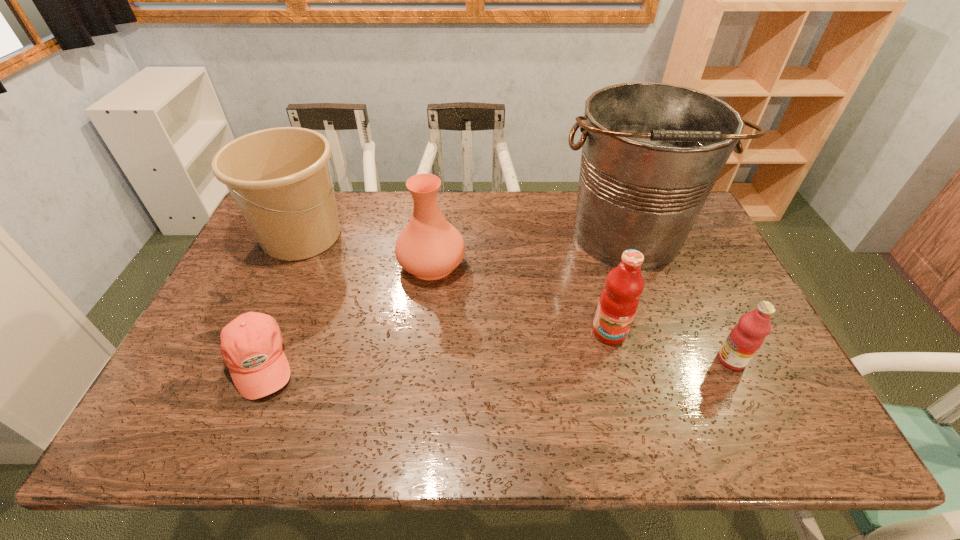
I want to click on vacant space located on the front of the left bucket, so click(259, 331).

The width and height of the screenshot is (960, 540). In order to click on vacant region located on the right of the vase in this screenshot , I will do `click(587, 264)`.

At what (x,y) coordinates should I click in order to perform the action: click on vacant area situated 0.180m on the front label of the farther fruit juice. Please return your answer as a coordinate pair (x, y). Image resolution: width=960 pixels, height=540 pixels. Looking at the image, I should click on (630, 411).

Where is `free spot located on the label of the second shortest object`? Image resolution: width=960 pixels, height=540 pixels. free spot located on the label of the second shortest object is located at coordinates (581, 360).

Identify the location of vacant space located 0.260m on the label of the second shortest object. This screenshot has width=960, height=540. (613, 360).

Identify the location of free spot located 0.050m on the label of the second shortest object. (698, 360).

This screenshot has width=960, height=540. Find the location of `free space located on the right of the baseball cap`. free space located on the right of the baseball cap is located at coordinates (443, 362).

Find the location of a particular element. Image resolution: width=960 pixels, height=540 pixels. bucket situated at the left edge is located at coordinates (280, 178).

The height and width of the screenshot is (540, 960). I want to click on baseball cap present at the left edge, so click(x=251, y=345).

Identify the location of bucket located at the right edge. This screenshot has height=540, width=960. (651, 152).